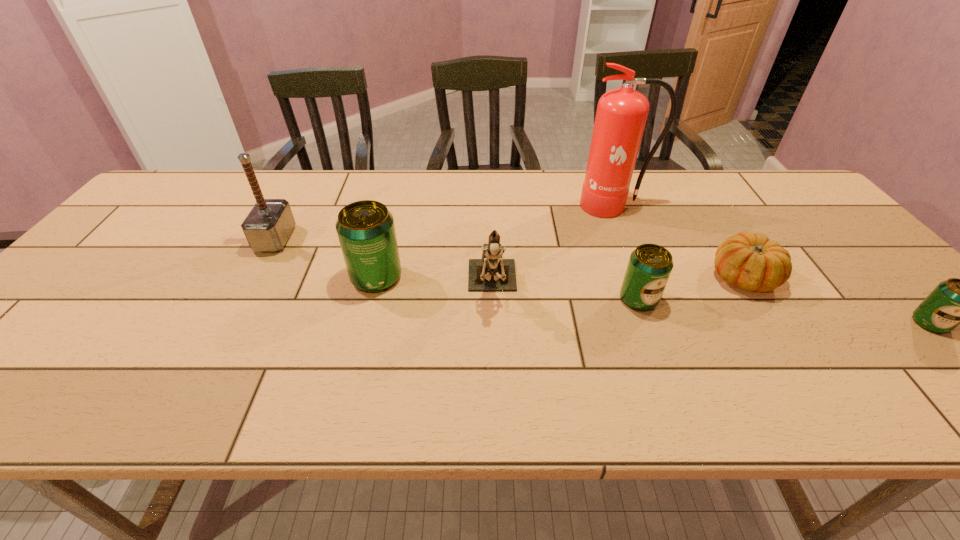
Locate an element on the screen. The width and height of the screenshot is (960, 540). the tallest beer can is located at coordinates (366, 231).

At what (x,y) coordinates should I click in order to perform the action: click on the second object from left to right. Please return your answer as a coordinate pair (x, y). This screenshot has height=540, width=960. Looking at the image, I should click on (366, 231).

Where is `the second tallest beer can`? The width and height of the screenshot is (960, 540). the second tallest beer can is located at coordinates (650, 265).

Locate an element on the screen. the second beer can from left to right is located at coordinates (650, 265).

The image size is (960, 540). What are the coordinates of `the rightmost object` in the screenshot? It's located at (955, 301).

The width and height of the screenshot is (960, 540). In order to click on the shortest beer can in this screenshot , I will do `click(955, 301)`.

The image size is (960, 540). Identify the location of the tallest object. (621, 115).

You are a GUI agent. You are given a task and a screenshot of the screen. Output one action in this format:
    pyautogui.click(x=<x>, y=<y>)
    Task: Click on the farthest object
    
    Given the screenshot: What is the action you would take?
    pyautogui.click(x=621, y=115)

At what (x,y) coordinates should I click in order to perform the action: click on the second farthest object. Please return your answer as a coordinate pair (x, y). Looking at the image, I should click on (267, 227).

Image resolution: width=960 pixels, height=540 pixels. Identify the location of hammer. (267, 227).